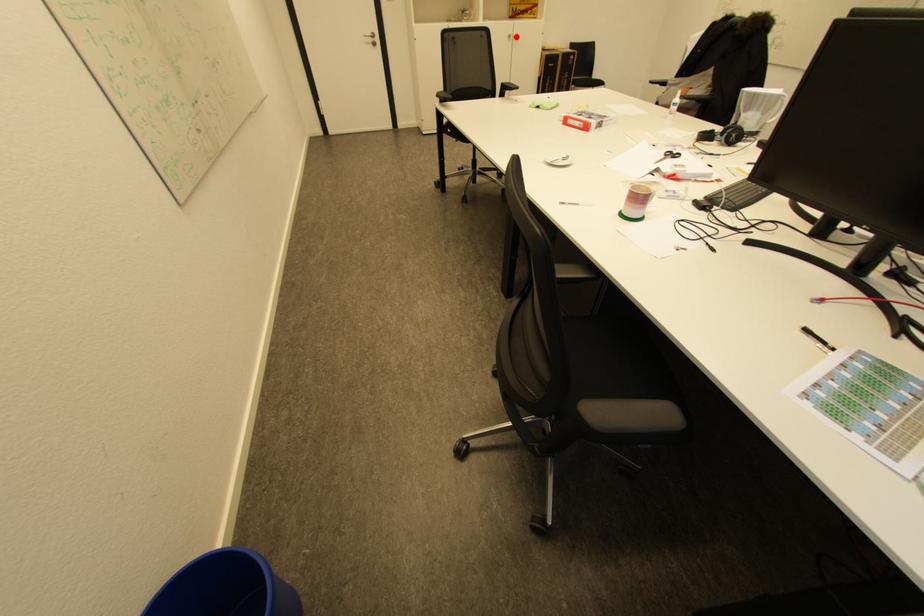
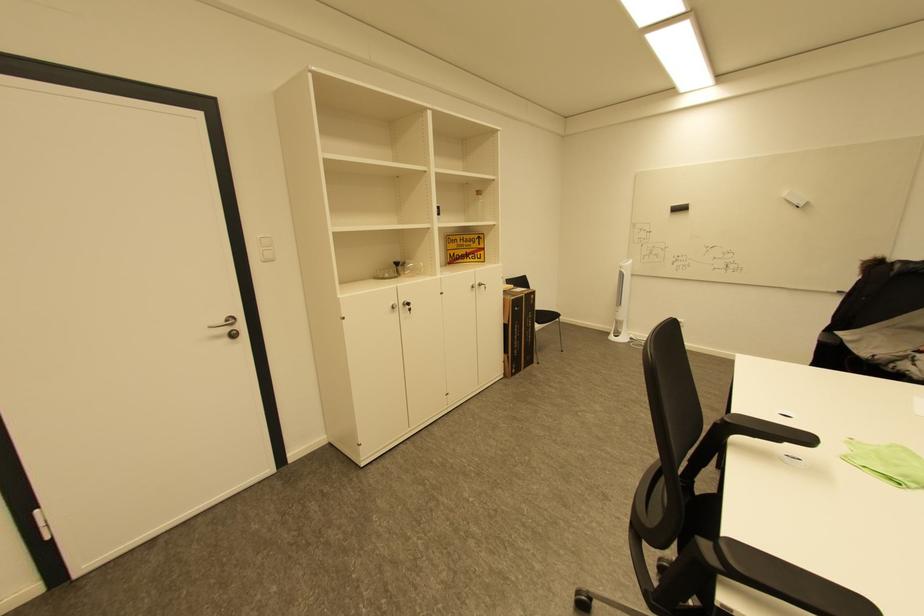
Find the pixel in the second image that matches the highlighted location in the first image.

(479, 286)